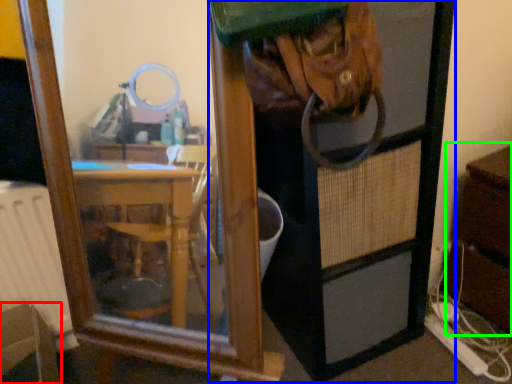
Question: Which object is positioned closest to furniture (highlighted by a red box)? Select from screen door (highlighted by a blue box) and dresser (highlighted by a green box).

Choices:
 (A) screen door
 (B) dresser

Answer: (A)